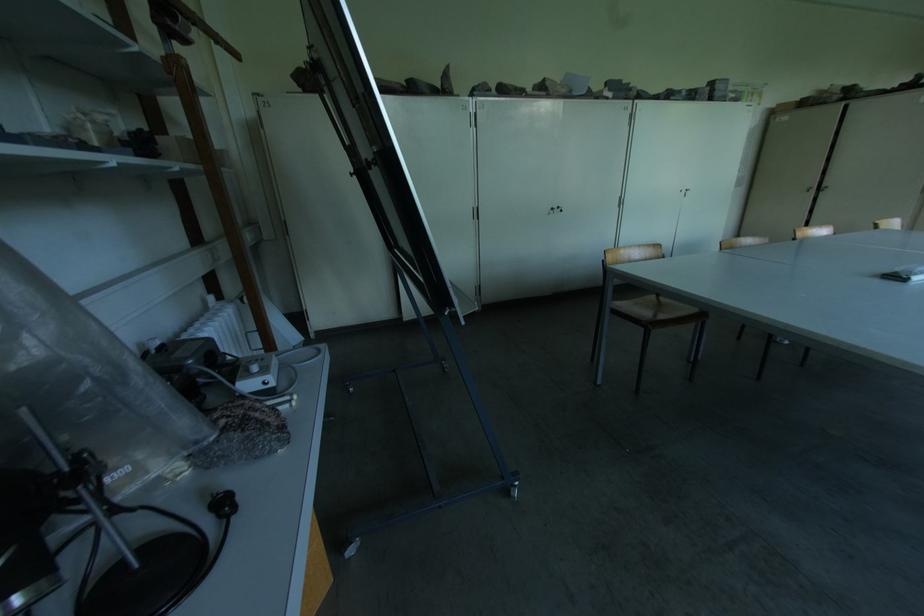
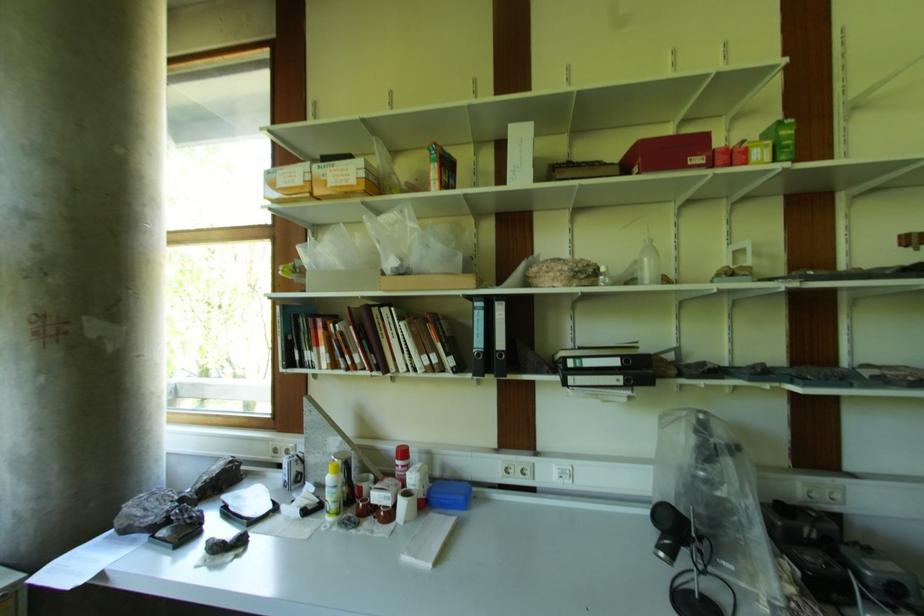
Question: The images are taken continuously from a first-person perspective. In which direction is your viewpoint rotating?

Choices:
 (A) Left
 (B) Right
 (C) Up
 (D) Down

Answer: (A)